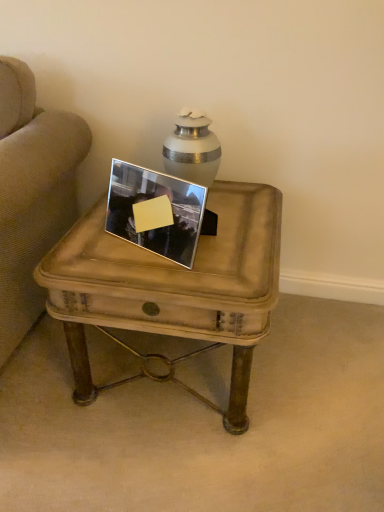
At what (x,y) coordinates should I click in order to perform the action: click on vacant space to the right of silver metallic picture frame at center. Please return your answer as a coordinate pair (x, y). This screenshot has width=384, height=512. Looking at the image, I should click on (243, 238).